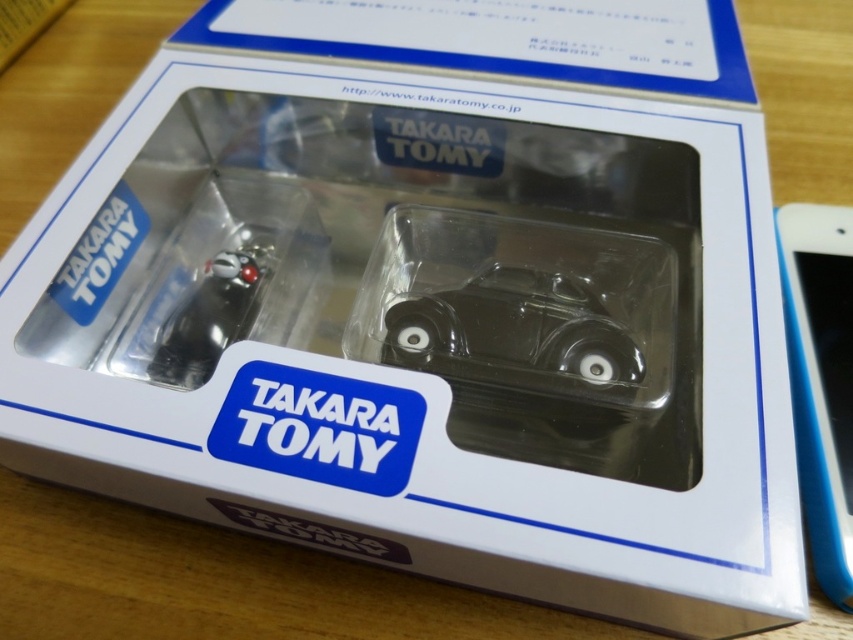
Question: Which object is positioned farthest from the shiny black car at center?

Choices:
 (A) blue glossy smartphone at right
 (B) transparent plastic car at center

Answer: (A)

Question: Does blue glossy smartphone at right have a lesser width compared to shiny black car at center?

Choices:
 (A) yes
 (B) no

Answer: (B)

Question: Is transparent plastic car at center to the right of shiny black car at center from the viewer's perspective?

Choices:
 (A) yes
 (B) no

Answer: (A)

Question: Can you confirm if blue glossy smartphone at right is wider than shiny black car at center?

Choices:
 (A) yes
 (B) no

Answer: (A)

Question: Which point is farther to the camera?

Choices:
 (A) transparent plastic car at center
 (B) blue glossy smartphone at right
 (C) shiny black car at center

Answer: (C)

Question: Estimate the real-world distances between objects in this image. Which object is closer to the shiny black car at center?

Choices:
 (A) blue glossy smartphone at right
 (B) transparent plastic car at center

Answer: (B)